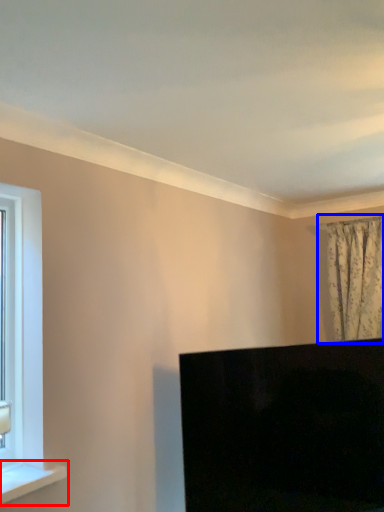
Question: Which point is closer to the camera, window sill (highlighted by a red box) or curtain (highlighted by a blue box)?

Choices:
 (A) window sill
 (B) curtain

Answer: (A)